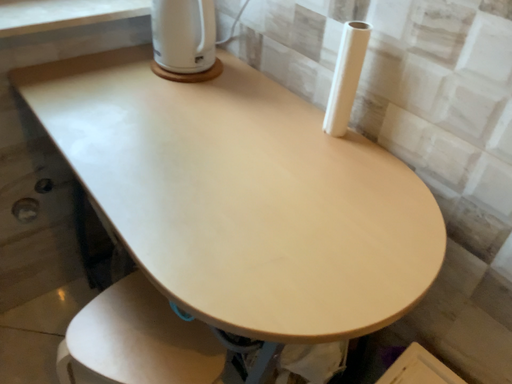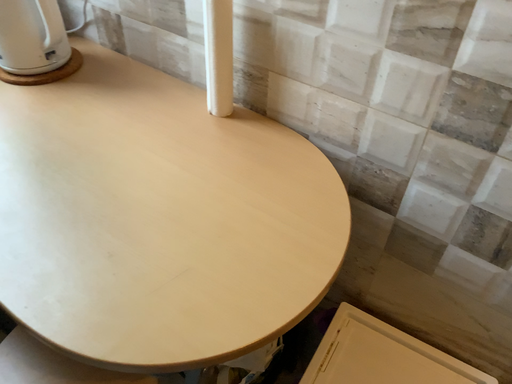
Question: Which way did the camera rotate in the video?

Choices:
 (A) rotated right
 (B) rotated left

Answer: (A)